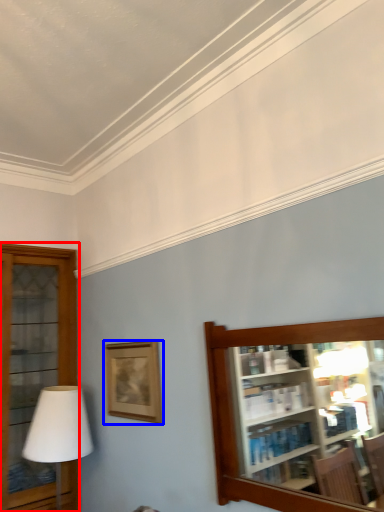
Question: Which object is closer to the camera taking this photo, shelf (highlighted by a red box) or picture frame (highlighted by a blue box)?

Choices:
 (A) shelf
 (B) picture frame

Answer: (B)